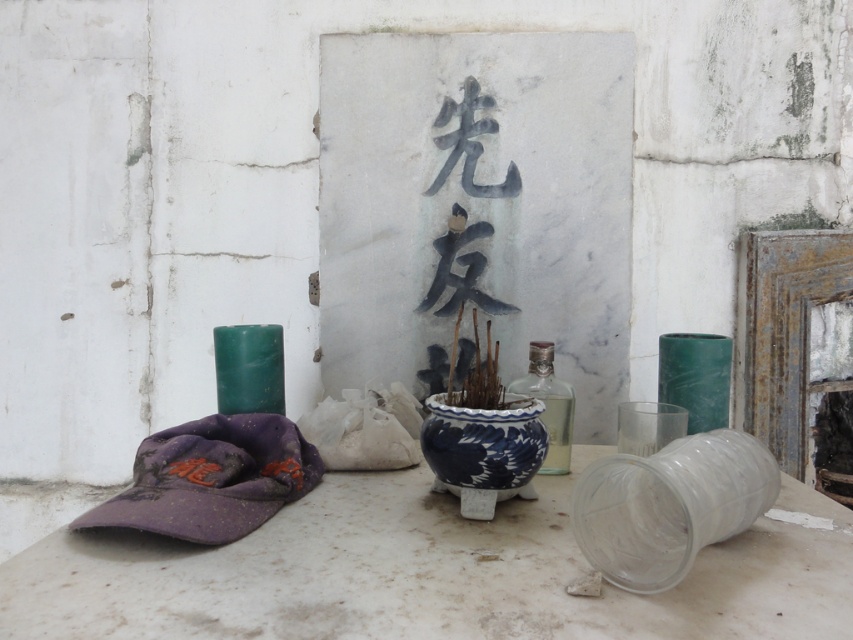
You are at a historical site and need to pour water into the transparent plastic cup at lower right and the clear glass bottle at center. Which container will require more water to fill completely?

The clear glass bottle at center requires more water to fill completely because it is taller than the transparent plastic cup at lower right.

You are a visitor at a historical site and want to place a small souvenir in either the transparent plastic cup at lower right or the clear glass bottle at center. Which container is closer to you?

The transparent plastic cup at lower right is closer to you since it is only 22.17 centimeters away from the clear glass bottle at center, which is likely farther away.